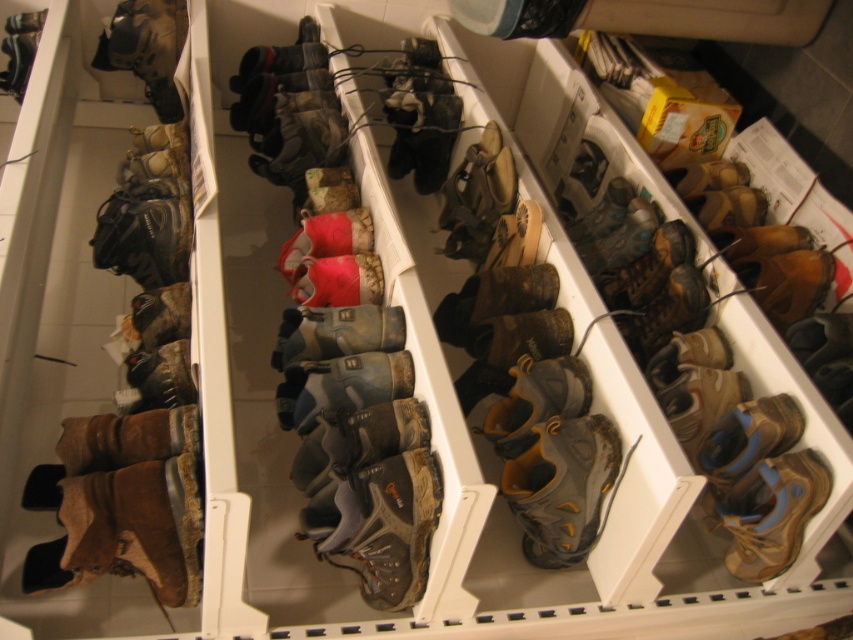
You are organizing the storage area and need to move the brown suede boot at center and the brown suede boots at left. Which one should you move first to access the other?

You should move the brown suede boot at center first because it is positioned over the brown suede boots at left, so removing it will allow access to the brown suede boots at left.

You are a warehouse worker who needs to place a new box that is 15 inches wide between the brown suede boot at center and the brown suede boots at left. Can you fit the box between them without moving any items?

The brown suede boot at center is 16.25 inches from the brown suede boots at left. Since the box is 15 inches wide, it can fit between them as the distance is greater than the box width.